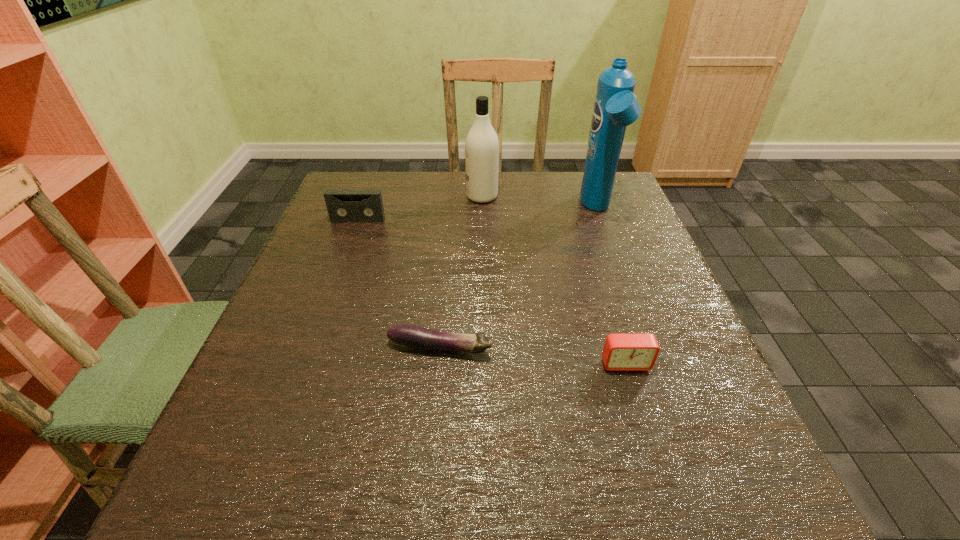
Where is `free location located 0.160m on the front-facing side of the left shampoo`? free location located 0.160m on the front-facing side of the left shampoo is located at coordinates point(407,197).

Image resolution: width=960 pixels, height=540 pixels. Identify the location of vacant space located on the front-facing side of the left shampoo. (429, 197).

Image resolution: width=960 pixels, height=540 pixels. What are the coordinates of `free region located on the front-facing side of the third tallest object` in the screenshot? It's located at click(312, 345).

Where is `vacant point located 0.160m on the front-facing side of the alarm clock`? vacant point located 0.160m on the front-facing side of the alarm clock is located at coordinates (656, 462).

Where is `vacant point located on the left of the shortest object`? The image size is (960, 540). vacant point located on the left of the shortest object is located at coordinates (262, 348).

Locate an element on the screen. object situated at the left edge is located at coordinates (344, 206).

Find the location of `shampoo located at the right edge`. shampoo located at the right edge is located at coordinates (615, 107).

The height and width of the screenshot is (540, 960). Identify the location of alarm clock at the right edge. (622, 352).

Find the location of `object located in the far right corner section of the desktop`. object located in the far right corner section of the desktop is located at coordinates (615, 107).

At what (x,y) coordinates should I click in order to perform the action: click on vacant region at the far edge of the desktop. Please return your answer as a coordinate pair (x, y). Looking at the image, I should click on (534, 205).